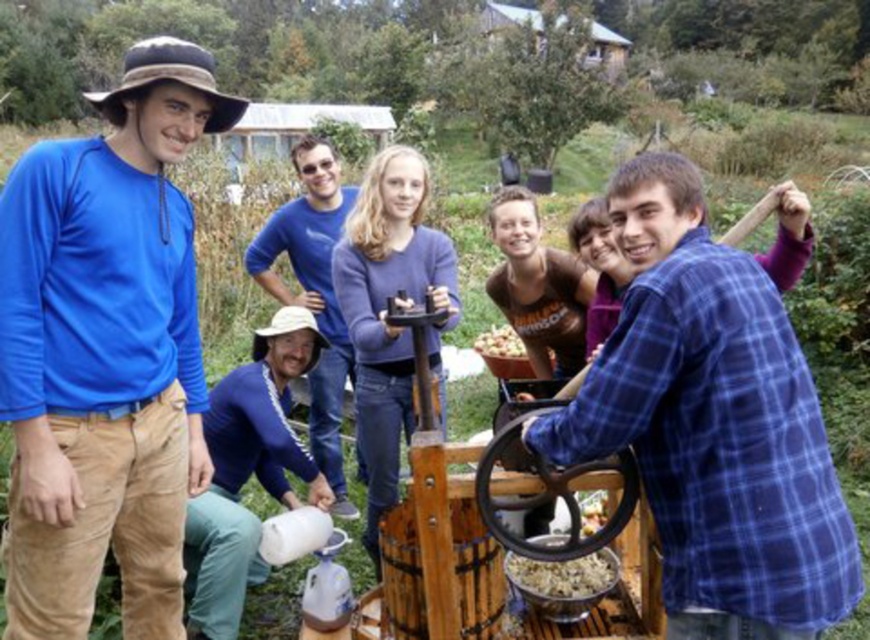
Question: Does blue cotton shirt at upper left have a larger size compared to blue cotton shirt at center?

Choices:
 (A) yes
 (B) no

Answer: (A)

Question: Which of the following is the closest to the observer?

Choices:
 (A) (705, 516)
 (B) (318, 385)
 (C) (490, 355)
 (D) (563, 586)

Answer: (A)

Question: Does blue cotton shirt at upper left appear on the left side of blue cotton shirt at center?

Choices:
 (A) yes
 (B) no

Answer: (A)

Question: Can you confirm if blue plaid shirt at center is positioned to the right of smooth brown flour at center?

Choices:
 (A) no
 (B) yes

Answer: (B)

Question: Which object is positioned closest to the smooth brown flour at center?

Choices:
 (A) blue cotton shirt at center
 (B) smooth brown nuts at center

Answer: (A)

Question: Which of the following is the closest to the observer?

Choices:
 (A) (599, 570)
 (B) (338, 324)
 (C) (134, 268)
 (D) (506, 324)

Answer: (C)